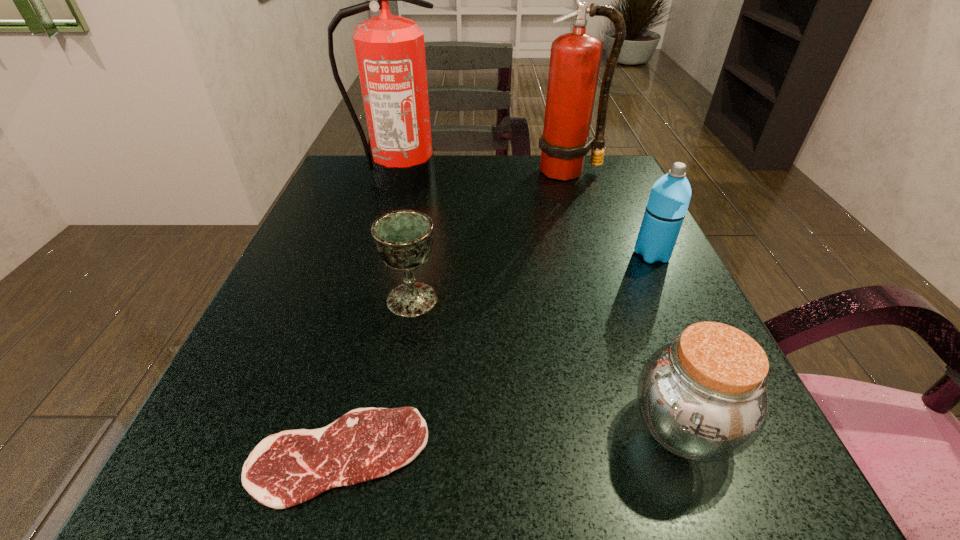
Where is `vacant area that lies between the jar and the shortest object`? The height and width of the screenshot is (540, 960). vacant area that lies between the jar and the shortest object is located at coordinates (511, 441).

The width and height of the screenshot is (960, 540). What are the coordinates of `free space between the shortest object and the jar` in the screenshot? It's located at (511, 441).

Locate an element on the screen. free point between the jar and the fourth shortest object is located at coordinates (667, 340).

Where is `vacant space that is in between the left fire extinguisher and the right fire extinguisher`? The image size is (960, 540). vacant space that is in between the left fire extinguisher and the right fire extinguisher is located at coordinates (484, 175).

You are a GUI agent. You are given a task and a screenshot of the screen. Output one action in this format:
    pyautogui.click(x=<x>, y=<y>)
    Task: Click on the empty space between the left fire extinguisher and the shortest object
    
    Given the screenshot: What is the action you would take?
    point(369,318)

You are a GUI agent. You are given a task and a screenshot of the screen. Output one action in this format:
    pyautogui.click(x=<x>, y=<y>)
    Task: Click on the vacant area between the left fire extinguisher and the jar
    
    Given the screenshot: What is the action you would take?
    pyautogui.click(x=541, y=302)

You are a GUI agent. You are given a task and a screenshot of the screen. Output one action in this format:
    pyautogui.click(x=<x>, y=<y>)
    Task: Click on the empty location between the right fire extinguisher and the jar
    
    Given the screenshot: What is the action you would take?
    pyautogui.click(x=626, y=299)

The image size is (960, 540). Identify the location of empty location between the jar and the third nearest object. (548, 363).

Where is `free space between the thermos bottle and the left fire extinguisher`? The image size is (960, 540). free space between the thermos bottle and the left fire extinguisher is located at coordinates (525, 216).

This screenshot has width=960, height=540. In order to click on vacant area that lies between the fourth nearest object and the shortest object in this screenshot , I will do `click(495, 355)`.